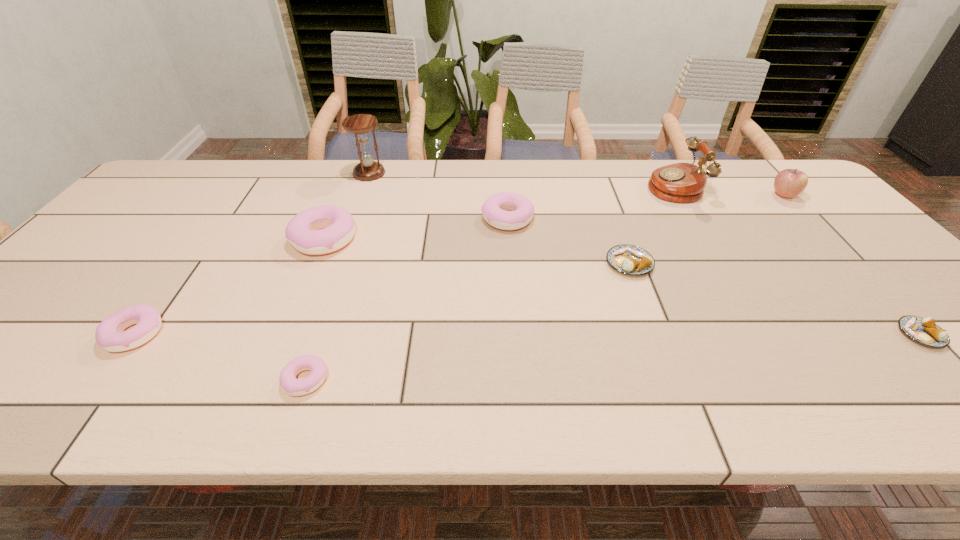
You are a GUI agent. You are given a task and a screenshot of the screen. Output one action in this format:
    pyautogui.click(x=<x>, y=<y>)
    Task: Click on the tallest object
    This screenshot has height=540, width=960.
    Given the screenshot: What is the action you would take?
    pyautogui.click(x=360, y=124)

Where is `telephone`? telephone is located at coordinates (681, 182).

Find the location of a particular element. This screenshot has width=960, height=540. the eighth shortest object is located at coordinates (681, 182).

Identify the location of apple. The width and height of the screenshot is (960, 540). (788, 183).

This screenshot has height=540, width=960. I want to click on the tallest pastry, so pyautogui.click(x=302, y=231).

Where is `the biggest pink pastry`? This screenshot has height=540, width=960. the biggest pink pastry is located at coordinates (302, 231).

I want to click on the third pastry from right to left, so click(521, 209).

The width and height of the screenshot is (960, 540). In order to click on the fifth shortest object in this screenshot , I will do `click(521, 209)`.

Find the location of `the leftmost object`. the leftmost object is located at coordinates (109, 335).

Identify the location of the leftmost pastry. The width and height of the screenshot is (960, 540). (109, 335).